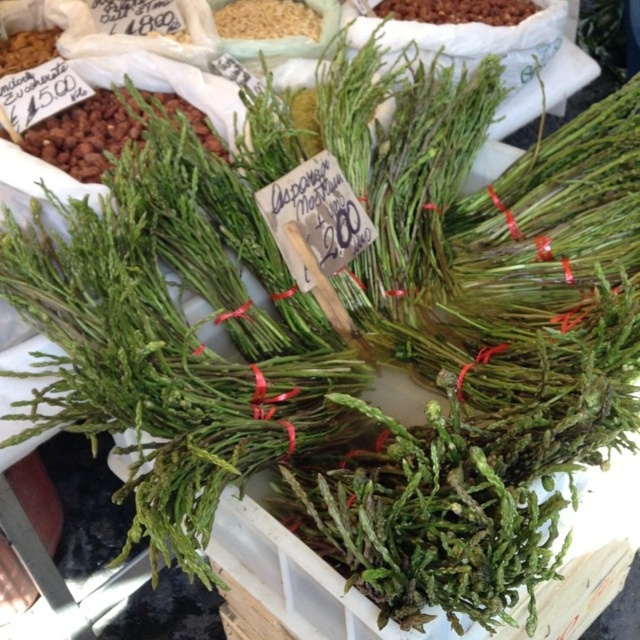
Question: Which point is farther to the camera?

Choices:
 (A) (403, 19)
 (B) (246, 24)

Answer: (A)

Question: In this image, where is green leafy vegetable at upper left located relative to brown grain at upper center?

Choices:
 (A) right
 (B) left

Answer: (B)

Question: Among these objects, which one is nearest to the camera?

Choices:
 (A) brown grain at upper center
 (B) brown crunchy nuts at upper center

Answer: (B)

Question: Does green leafy vegetable at upper left have a lesser width compared to brown crunchy nuts at upper center?

Choices:
 (A) no
 (B) yes

Answer: (A)

Question: Which object appears closest to the camera in this image?

Choices:
 (A) brown crunchy nuts at upper center
 (B) green leafy vegetable at upper left

Answer: (B)

Question: Is green leafy vegetable at upper left thinner than brown crunchy nuts at upper center?

Choices:
 (A) no
 (B) yes

Answer: (A)